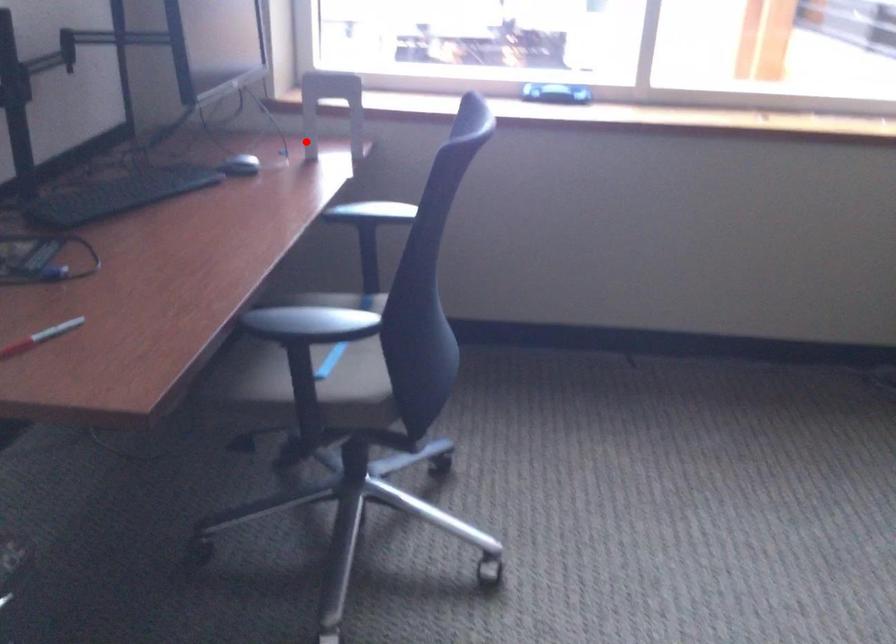
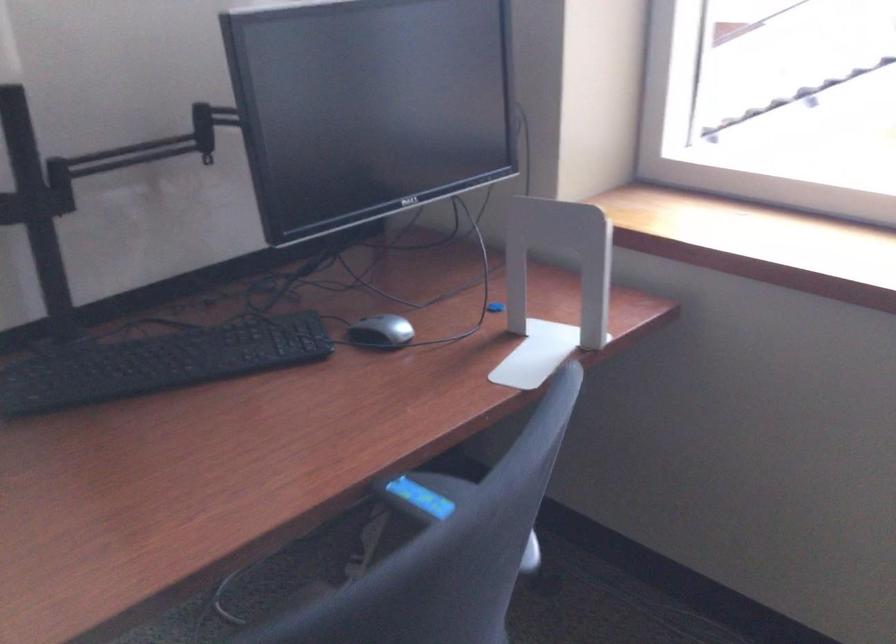
Question: I am providing you with two images of the same scene from different viewpoints. Image1 has a red point marked. In image2, the corresponding 3D location appears at what relative position? Reply with the corresponding letter.

Choices:
 (A) Closer
 (B) Farther

Answer: (A)